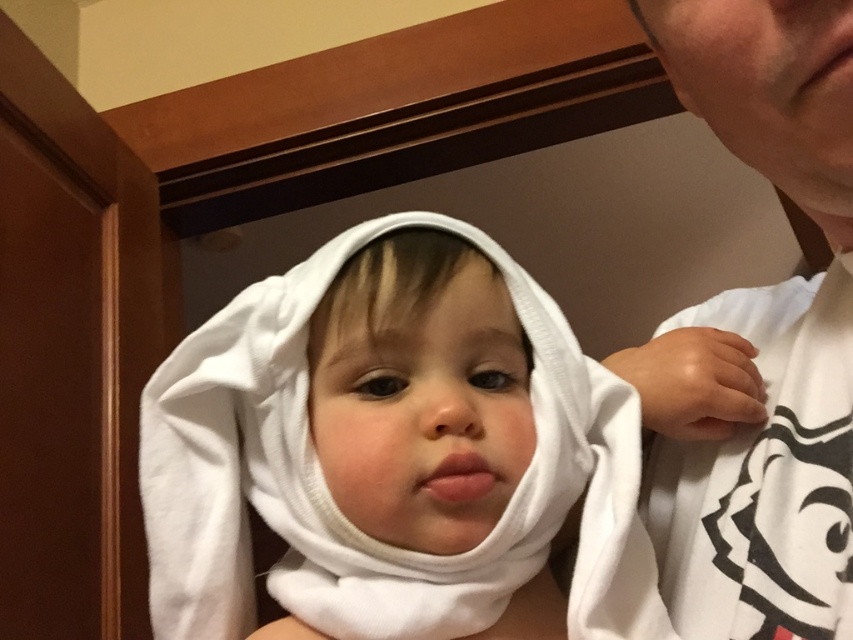
You are holding a 12 inch ruler and want to measure the distance from your eyes to the point marked as point (x=321, y=616) in the image. Can you reach it with your ruler?

The distance of point (x=321, y=616) from viewer is 16.50 inches, so the ruler is 12 inches long, which is shorter than the distance. You cannot reach it with your ruler.

You are a photographer adjusting the lighting in the room. You notice a point at coordinates (334, 502). Where is this point located in relation to the objects in the scene?

The point at coordinates (334, 502) is located on the white soft cloth at center.

You are a photographer setting up a shoot in the scene. You need to place a small prop between the white soft cloth at center and the white cotton shirt at upper right. Which object should the prop be closer to if it needs to be placed near the smaller one?

The prop should be placed closer to the white soft cloth at center because it is smaller than the white cotton shirt at upper right.